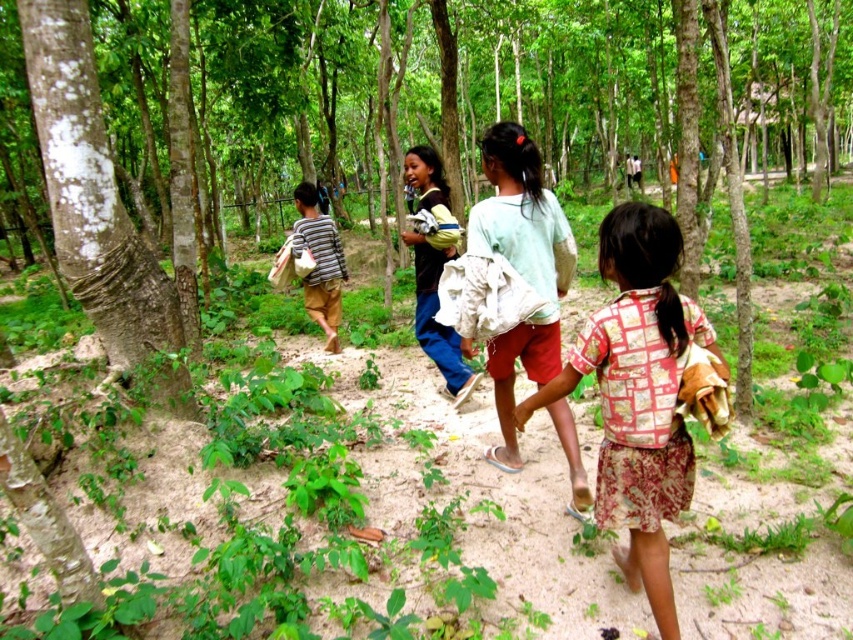
Question: Does printed cotton shirt at center have a smaller size compared to light blue jeans at center?

Choices:
 (A) yes
 (B) no

Answer: (A)

Question: Which is farther from the light blue jeans at center?

Choices:
 (A) striped fabric shirt at center
 (B) printed cotton shirt at center

Answer: (B)

Question: Can you confirm if light green fabric at center is bigger than light blue jeans at center?

Choices:
 (A) no
 (B) yes

Answer: (B)

Question: Which of the following is the farthest from the observer?

Choices:
 (A) printed cotton shirt at center
 (B) light blue jeans at center
 (C) green rough bark tree at center
 (D) white textured bark at left

Answer: (B)

Question: Is light green fabric at center positioned behind striped fabric shirt at center?

Choices:
 (A) no
 (B) yes

Answer: (A)

Question: Which object is the closest to the light green fabric at center?

Choices:
 (A) printed cotton shirt at center
 (B) light blue jeans at center

Answer: (A)